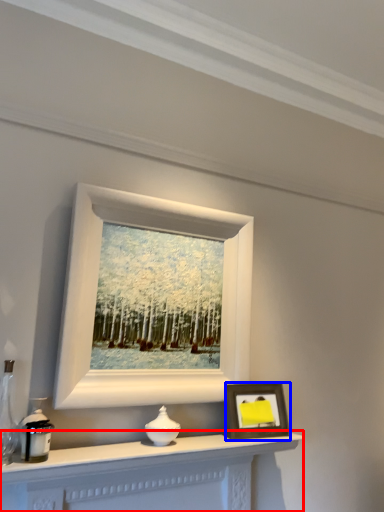
Question: Which object is further to the camera taking this photo, table (highlighted by a red box) or picture frame (highlighted by a blue box)?

Choices:
 (A) table
 (B) picture frame

Answer: (B)